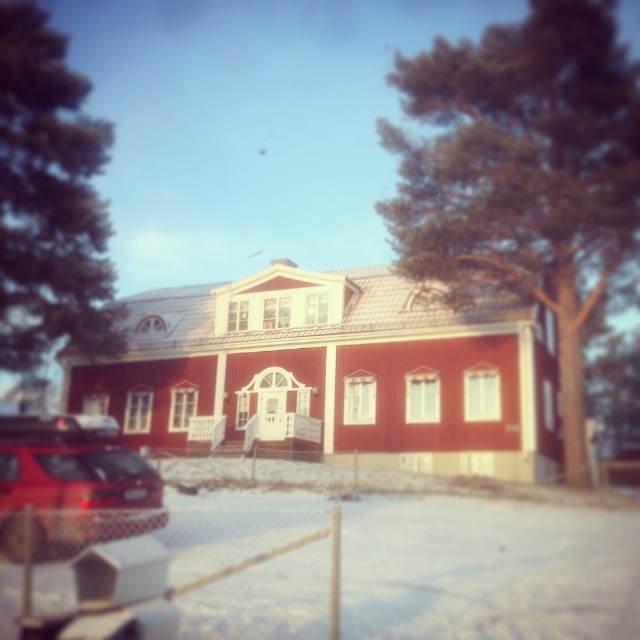
You are standing at the point with coordinates point (140, 465) and want to walk to the point with coordinates point (550, 176). Is there a direct path between these two points without any obstacles?

The point (550, 176) is behind point (140, 465), so there might be an obstacle blocking the direct path between them. You may need to find an alternative route.

You are standing in front of the two story building with a red facade and white trim. You notice a green textured tree at upper right. Based on its coordinates, can you determine if the tree is closer to the top or the bottom of the image?

The green textured tree at upper right is located at coordinates point (524, 172). Since the y coordinate is 0.819, which is closer to 1.0, the tree is closer to the top of the image.